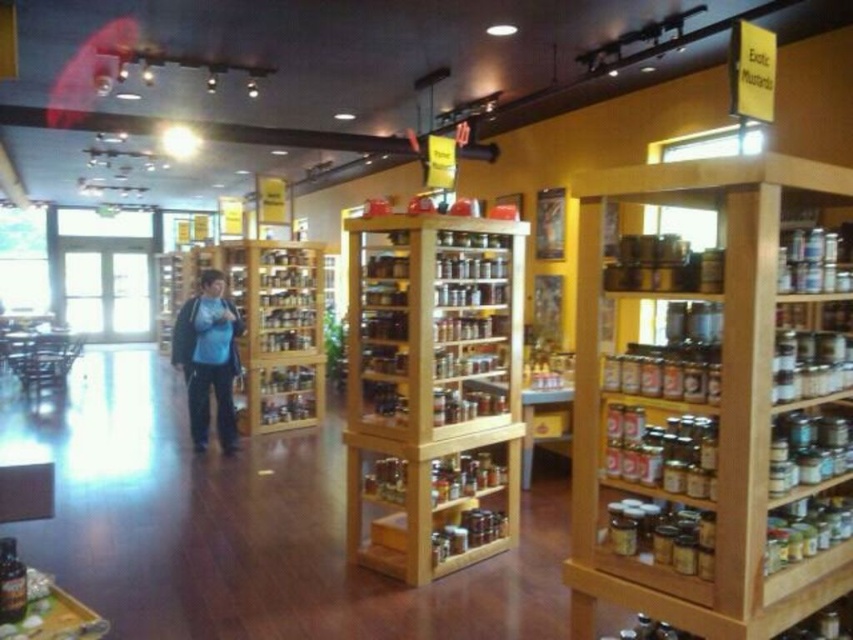
Question: Is wooden shelves at right thinner than wooden spice rack at center?

Choices:
 (A) yes
 (B) no

Answer: (B)

Question: Does wooden shelves at right appear over wooden spice rack at center?

Choices:
 (A) yes
 (B) no

Answer: (A)

Question: Which point appears closest to the camera in this image?

Choices:
 (A) (635, 532)
 (B) (222, 412)
 (C) (497, 339)

Answer: (A)

Question: Can you confirm if wooden shelves at right is bigger than wooden spice rack at center?

Choices:
 (A) yes
 (B) no

Answer: (B)

Question: Which is nearer to the wooden spice rack at center?

Choices:
 (A) wooden shelves at right
 (B) blue fabric shirt at center

Answer: (A)

Question: Among these points, which one is farthest from the camera?

Choices:
 (A) [195, 396]
 (B) [602, 250]
 (C) [384, 339]

Answer: (A)